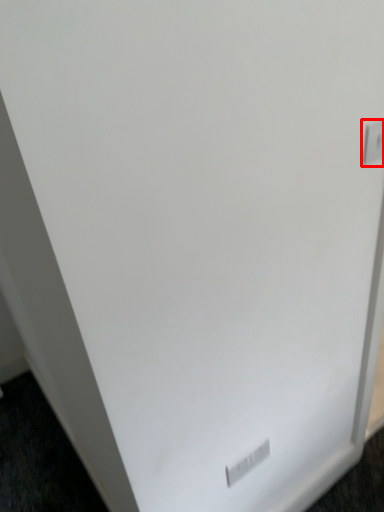
Question: From the image's perspective, considering the relative positions of electric outlet (annotated by the red box) and electric outlet in the image provided, where is electric outlet (annotated by the red box) located with respect to the staircase?

Choices:
 (A) below
 (B) above

Answer: (B)